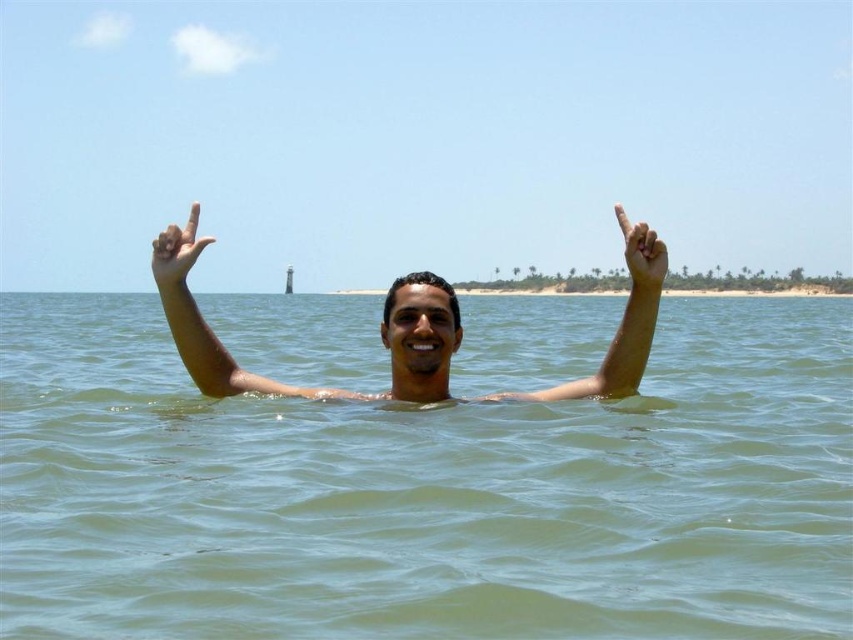
You are a photographer trying to capture the scene of the person making a rock on gesture. Based on the image, which object between the greenish water at upper center and the matte skin hand at upper center is positioned higher in the frame?

The greenish water at upper center is taller than the matte skin hand at upper center, so the greenish water at upper center is positioned higher in the frame.

You are a photographer trying to capture the scene of the greenish water at upper center and the matte skin hand at upper center. Given that your camera can focus on objects within a 35 meter range, will both subjects be in focus?

The greenish water at upper center and matte skin hand at upper center are 37.62 meters apart. Since the camera can only focus within 35 meters, the subjects are beyond the focus range, so they won not be in focus.